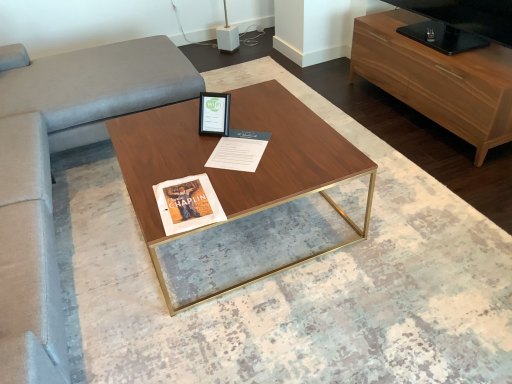
Find the location of `free spot above white paper at center (from a real-world perspective)`. free spot above white paper at center (from a real-world perspective) is located at coordinates (234, 140).